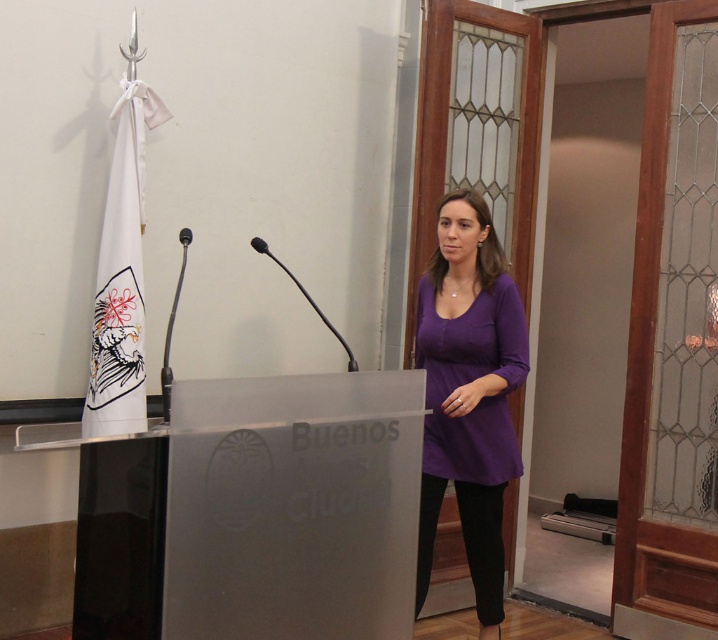
You are a photographer setting up for a speech event. You need to position a camera so it can capture both the clear acrylic podium at center and the purple soft fabric shirt at center. Considering their heights, which object should be placed closer to the camera to ensure both are in focus?

The clear acrylic podium at center is not as tall as the purple soft fabric shirt at center. To ensure both are in focus, position the shorter clear acrylic podium at center closer to the camera so that the height difference is minimized.

You are standing in the room where the woman is speaking. There are two points marked in the image. Which of the two points, point (294, 620) or point (500, 305), is closer to you?

Point (294, 620) is closer to the camera than point (500, 305), so it is closer to you.

You are an event organizer standing behind the clear acrylic podium at center and want to hand a document to the woman wearing the purple soft fabric shirt at center. Can you reach her without moving from your current position?

The clear acrylic podium at center is closer to the viewer than purple soft fabric shirt at center, so the woman is further away. You might need to step forward or ask her to come closer to hand the document.